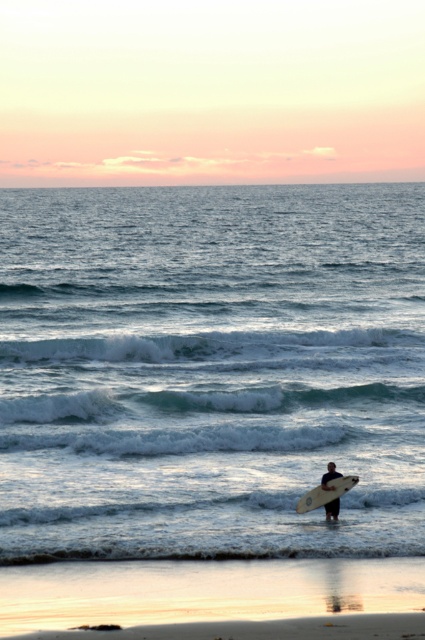
You are a photographer trying to capture the perfect shot of the smooth sand at lower center and the smooth white surfboard at lower center. Which object should you focus on if you want to include both in the frame without cropping either?

The smooth sand at lower center is bigger than the smooth white surfboard at lower center, so you should focus on the smooth sand at lower center to ensure both objects fit in the frame without cropping.